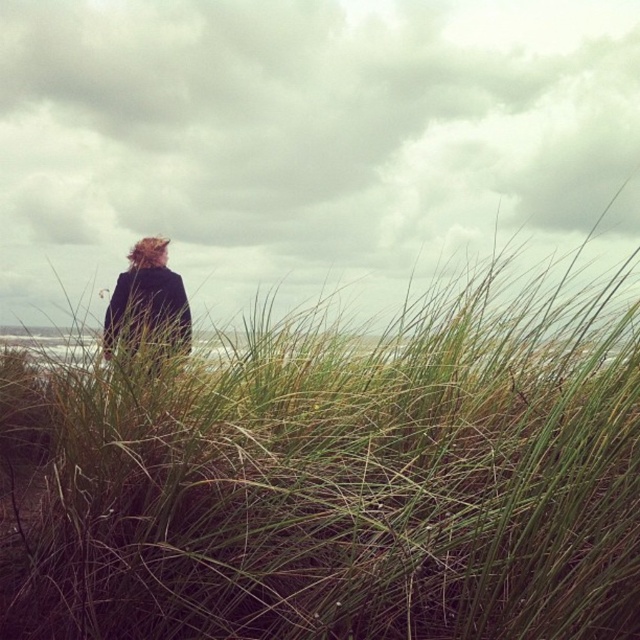
You are a photographer trying to capture the scene with a wide angle lens. You notice the green grassy at center and the dark woolen coat at center. Which object is wider in the image?

The green grassy at center is wider than the dark woolen coat at center.

You are standing at the point marked as point (336,476) in the image. What is the nearest object to you in the scene?

The nearest object to you at point (336,476) is the green grassy at center, as it is located exactly at that coordinate.